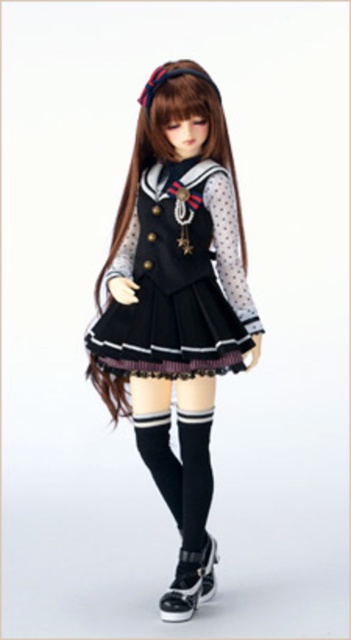
Question: Which of these objects is positioned farthest from the black satin dress at center?

Choices:
 (A) black leather shoe at lower center
 (B) matte black dress at center
 (C) black knit socks at lower center

Answer: (A)

Question: Which point is closer to the camera?

Choices:
 (A) black satin dress at center
 (B) matte black dress at center

Answer: (B)

Question: Is brown silky hair at center wider than black knit socks at lower center?

Choices:
 (A) yes
 (B) no

Answer: (A)

Question: Is matte black dress at center behind black leather shoe at lower center?

Choices:
 (A) no
 (B) yes

Answer: (A)

Question: Which point is farther to the camera?

Choices:
 (A) (149, 401)
 (B) (168, 317)

Answer: (A)

Question: Can you confirm if brown silky hair at center is bigger than black knit socks at lower center?

Choices:
 (A) yes
 (B) no

Answer: (A)